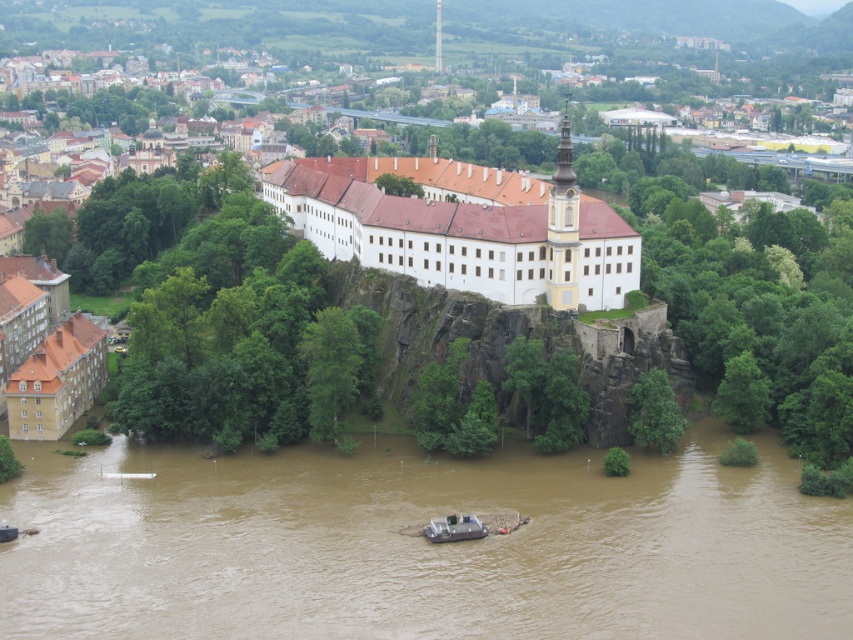
Can you confirm if white smooth building at center is positioned above metallic gray boat at center?

Correct, white smooth building at center is located above metallic gray boat at center.

Looking at this image, is white smooth building at center to the right of metallic gray boat at center from the viewer's perspective?

Correct, you'll find white smooth building at center to the right of metallic gray boat at center.

Between point (550, 224) and point (473, 536), which one is positioned in front?

Point (473, 536) is more forward.

Where is `white smooth building at center`? white smooth building at center is located at coordinates (466, 234).

Does point (646, 484) come farther from viewer compared to point (430, 534)?

Yes, point (646, 484) is behind point (430, 534).

Which is more to the left, brown muddy water at lower center or metallic gray boat at center?

brown muddy water at lower center is more to the left.

Is point (67, 516) positioned after point (463, 534)?

Yes.

Find the location of `brown muddy water at lower center`. brown muddy water at lower center is located at coordinates (421, 547).

Does point (637, 476) come behind point (527, 291)?

No, (637, 476) is in front of (527, 291).

Who is more forward, (270, 604) or (614, 257)?

Point (270, 604)

Find the location of a particular element. This screenshot has height=640, width=853. brown muddy water at lower center is located at coordinates (421, 547).